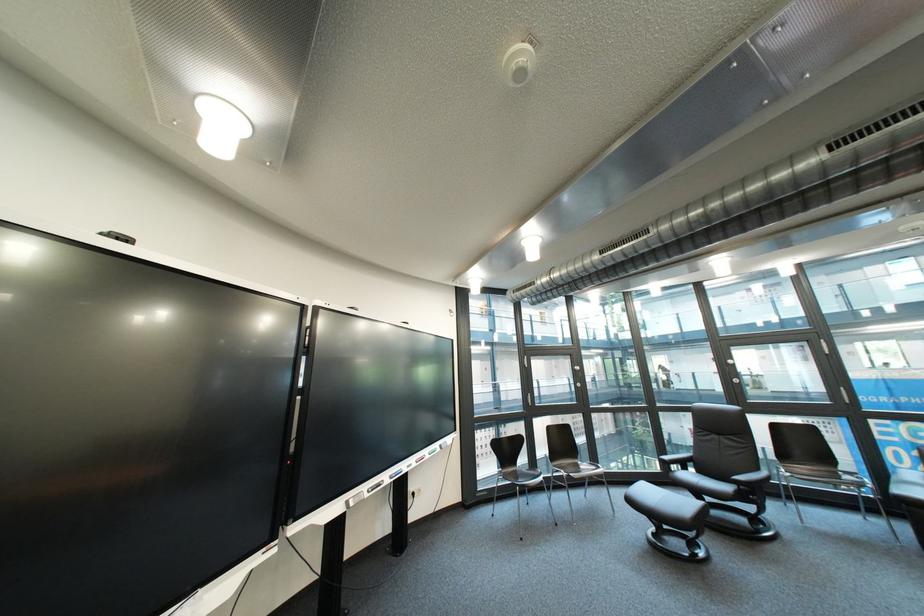
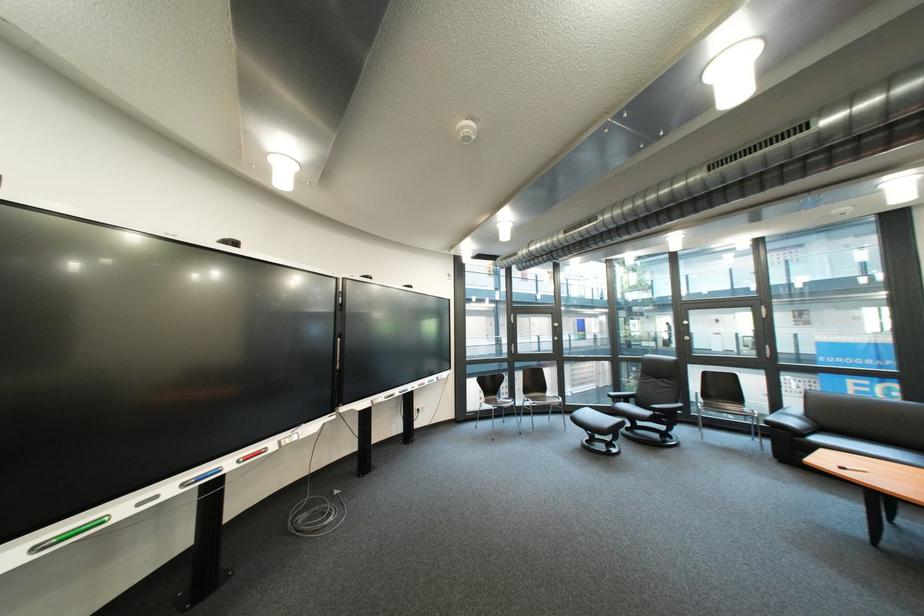
Find the pixel in the second image that matches (x=541, y=505) in the first image.

(517, 424)